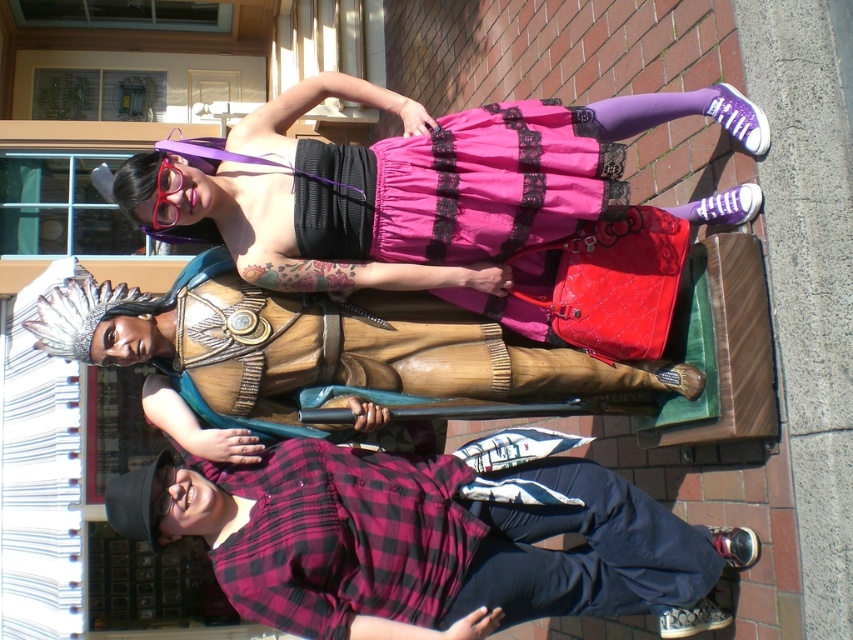
Question: Which point appears closest to the camera in this image?

Choices:
 (A) (390, 209)
 (B) (432, 349)
 (C) (653, 540)

Answer: (A)

Question: Is plaid flannel shirt at lower left to the right of pink satin skirt at upper center from the viewer's perspective?

Choices:
 (A) yes
 (B) no

Answer: (B)

Question: Can you confirm if plaid flannel shirt at lower left is positioned below wooden statue at center?

Choices:
 (A) no
 (B) yes

Answer: (B)

Question: Is plaid flannel shirt at lower left below wooden statue at center?

Choices:
 (A) yes
 (B) no

Answer: (A)

Question: Estimate the real-world distances between objects in this image. Which object is closer to the pink satin skirt at upper center?

Choices:
 (A) wooden statue at center
 (B) plaid flannel shirt at lower left

Answer: (A)

Question: Estimate the real-world distances between objects in this image. Which object is closer to the pink satin skirt at upper center?

Choices:
 (A) wooden statue at center
 (B) plaid flannel shirt at lower left

Answer: (A)